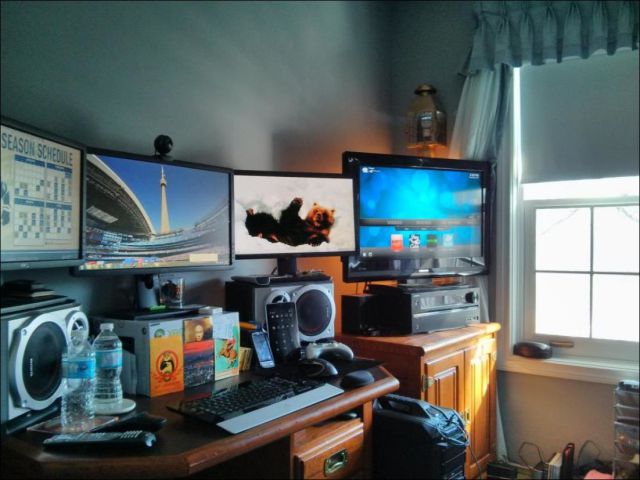
I want to click on television, so click(x=412, y=205).